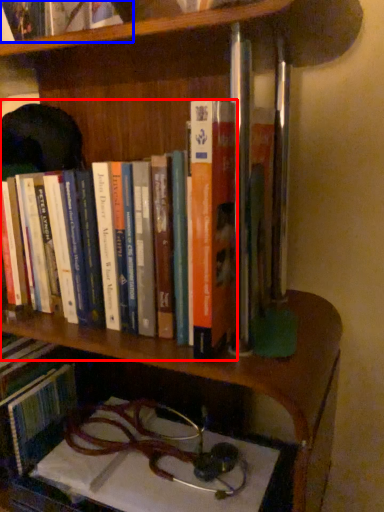
Question: Which object appears farthest to the camera in this image, book (highlighted by a red box) or book (highlighted by a blue box)?

Choices:
 (A) book
 (B) book

Answer: (A)